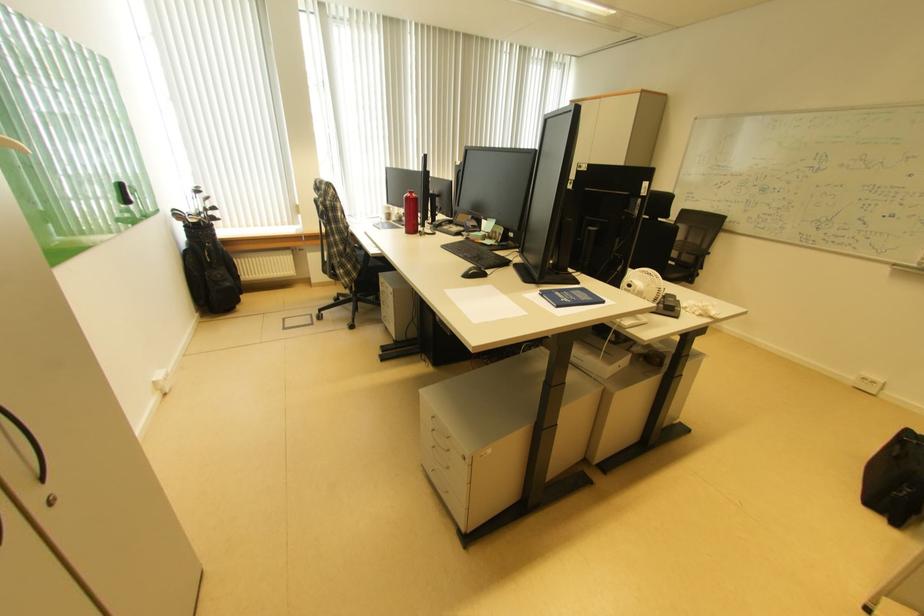
Where would you open the red water bottle? Please return your answer as a coordinate pair (x, y).

(410, 213)